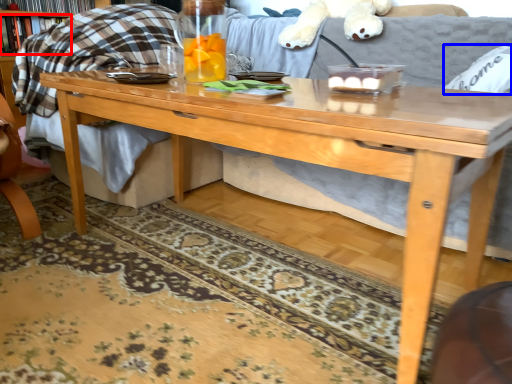
Question: Among these objects, which one is farthest to the camera, book (highlighted by a red box) or pillow (highlighted by a blue box)?

Choices:
 (A) book
 (B) pillow

Answer: (A)